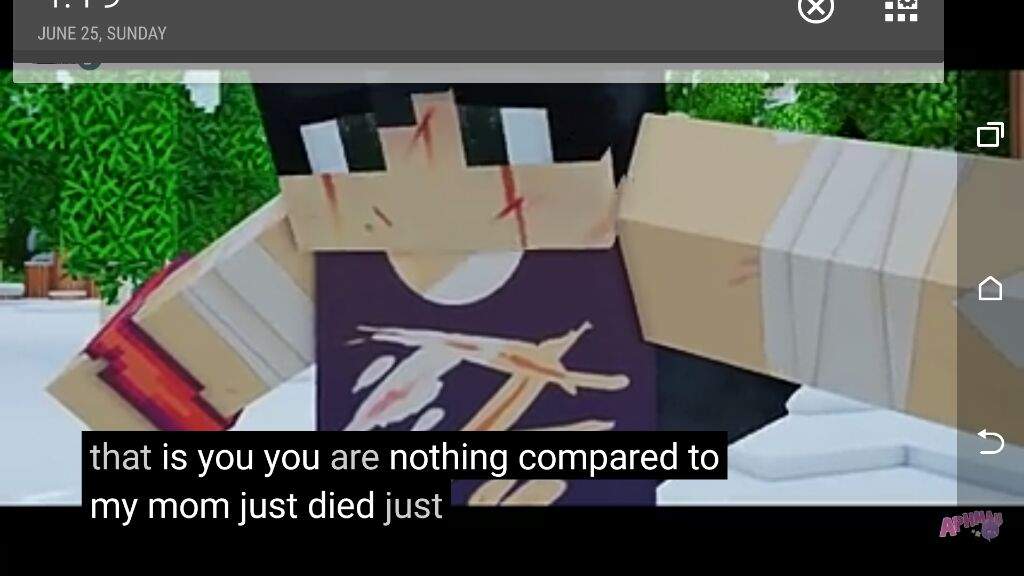
At what (x,y) coordinates should I click in order to perform the action: click on exit button. Please return your answer as a coordinate pair (x, y). The width and height of the screenshot is (1024, 576). Looking at the image, I should click on (813, 7).